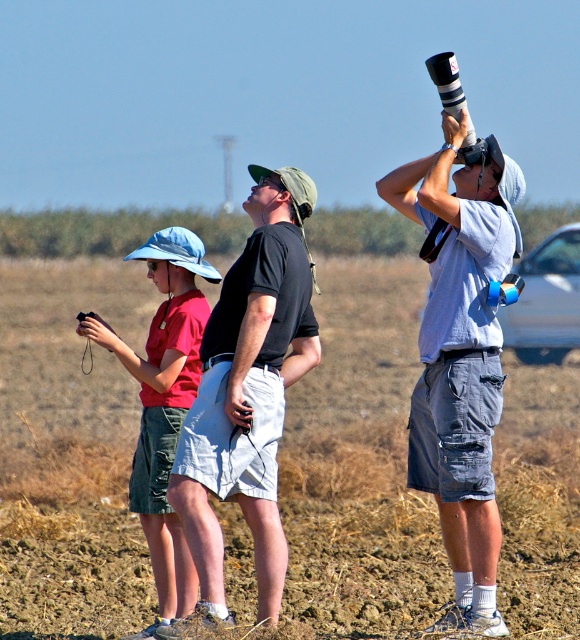
Question: Is matte red shirt at left positioned behind metallic silver car at right?

Choices:
 (A) no
 (B) yes

Answer: (A)

Question: Is brown soil at center to the left of black cotton shirt at center from the viewer's perspective?

Choices:
 (A) no
 (B) yes

Answer: (B)

Question: Which of these objects is positioned closest to the matte red shirt at left?

Choices:
 (A) gray cotton shirt at upper right
 (B) black cotton shirt at center

Answer: (A)

Question: Which object is closer to the camera taking this photo?

Choices:
 (A) matte red shirt at left
 (B) metallic silver car at right

Answer: (A)

Question: Is gray cotton shirt at upper right bigger than matte red shirt at left?

Choices:
 (A) yes
 (B) no

Answer: (B)

Question: Estimate the real-world distances between objects in this image. Which object is farther from the matte red shirt at left?

Choices:
 (A) metallic silver car at right
 (B) black cotton shirt at center
 (C) gray cotton shirt at upper right
 (D) brown soil at center

Answer: (D)